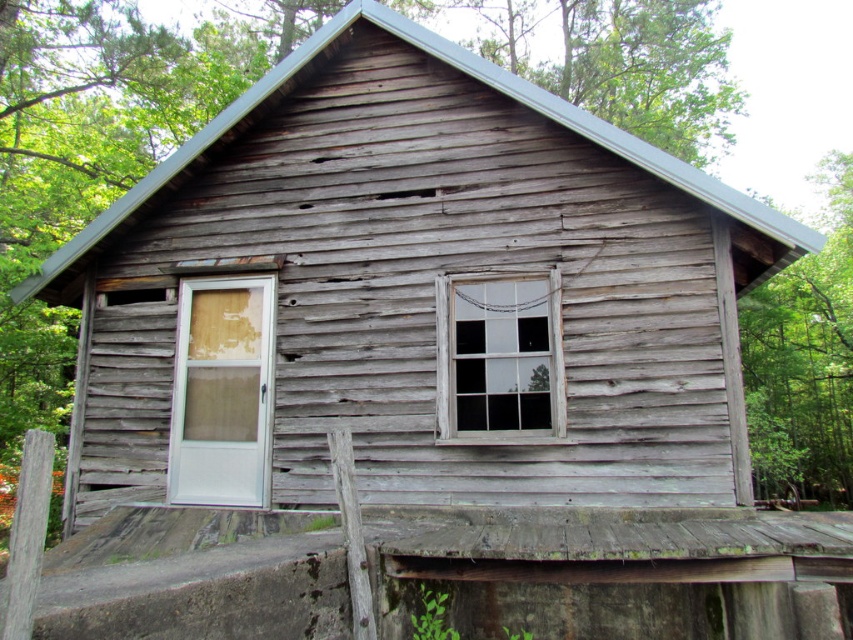
In the scene shown: Can you confirm if green leafy tree at upper right is smaller than clear glass window at center?

No.

Who is shorter, green leafy tree at upper right or clear glass window at center?

clear glass window at center

Identify the location of green leafy tree at upper right. (804, 360).

Is point (830, 458) more distant than point (218, 316)?

Yes, point (830, 458) is behind point (218, 316).

Does green leafy tree at upper right have a larger size compared to white plastic door at left?

Correct, green leafy tree at upper right is larger in size than white plastic door at left.

This screenshot has width=853, height=640. Find the location of `green leafy tree at upper right`. green leafy tree at upper right is located at coordinates click(804, 360).

You are a GUI agent. You are given a task and a screenshot of the screen. Output one action in this format:
    pyautogui.click(x=<x>, y=<y>)
    Task: Click on the white plastic door at left
    
    Given the screenshot: What is the action you would take?
    pyautogui.click(x=222, y=392)

Identify the location of white plastic door at left. (222, 392).

The image size is (853, 640). Find the location of `white plastic door at left`. white plastic door at left is located at coordinates (222, 392).